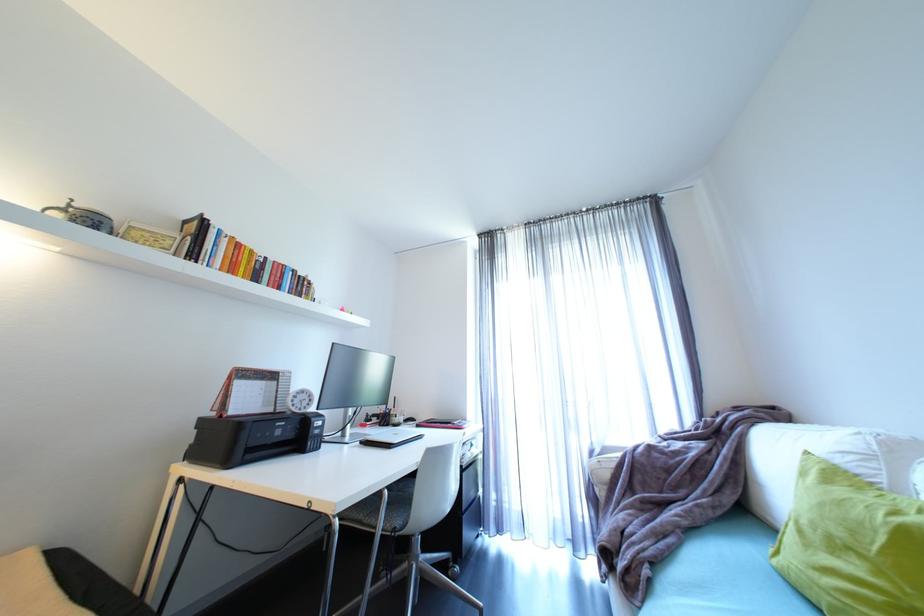
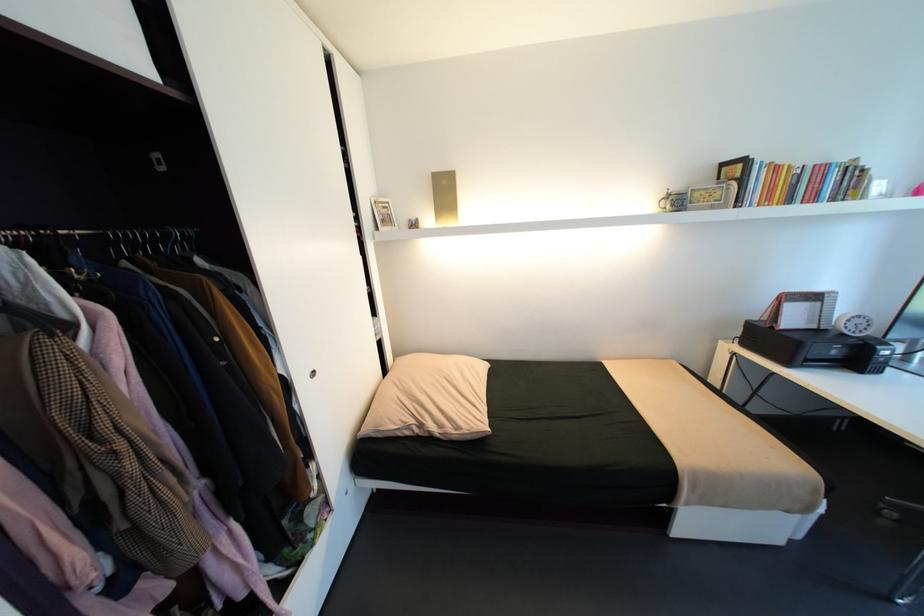
Find the pixel in the second image that matches [300,414] in the first image.

(850, 334)